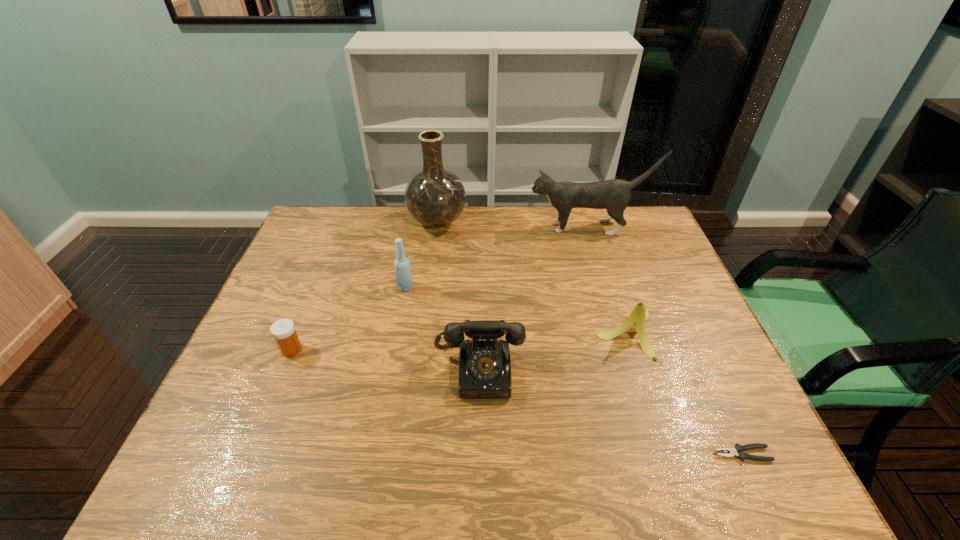
Identify the location of vacant space situated at the gripping part of the nearest object. (630, 454).

Where is `vase that is at the far edge`? The image size is (960, 540). vase that is at the far edge is located at coordinates (434, 197).

You are a GUI agent. You are given a task and a screenshot of the screen. Output one action in this format:
    pyautogui.click(x=<x>, y=<y>)
    Task: Click on the cat that is at the far edge
    The image size is (960, 540).
    Given the screenshot: What is the action you would take?
    pyautogui.click(x=614, y=195)

Locate an element on the screen. The width and height of the screenshot is (960, 540). object that is at the near edge is located at coordinates (736, 451).

In order to click on object located at the left edge in this screenshot , I will do `click(283, 330)`.

You are a GUI agent. You are given a task and a screenshot of the screen. Output one action in this format:
    pyautogui.click(x=<x>, y=<y>)
    Task: Click on the cat positioned at the right edge
    
    Given the screenshot: What is the action you would take?
    pyautogui.click(x=614, y=195)

Identify the location of banana that is at the right edge. click(638, 316).

Identify the location of pliers present at the right edge. The height and width of the screenshot is (540, 960). (736, 451).

This screenshot has width=960, height=540. I want to click on object situated at the far right corner, so click(614, 195).

Locate an element on the screen. This screenshot has height=540, width=960. object at the near right corner is located at coordinates (736, 451).